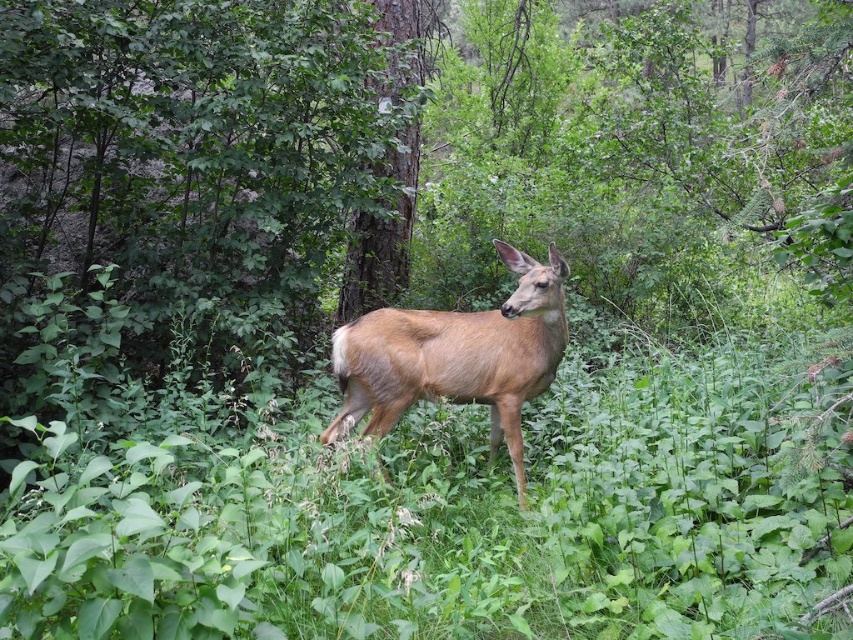
Between point (314, 625) and point (361, 397), which one is positioned behind?

Point (361, 397)

Is green leafy grass at center positioned behind brown matte deer at center?

No.

What do you see at coordinates (460, 518) in the screenshot? I see `green leafy grass at center` at bounding box center [460, 518].

I want to click on green leafy grass at center, so click(460, 518).